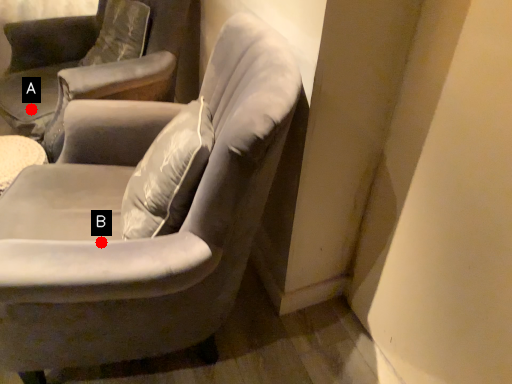
Question: Two points are circled on the image, labeled by A and B beside each circle. Among these points, which one is nearest to the camera?

Choices:
 (A) A is closer
 (B) B is closer

Answer: (B)